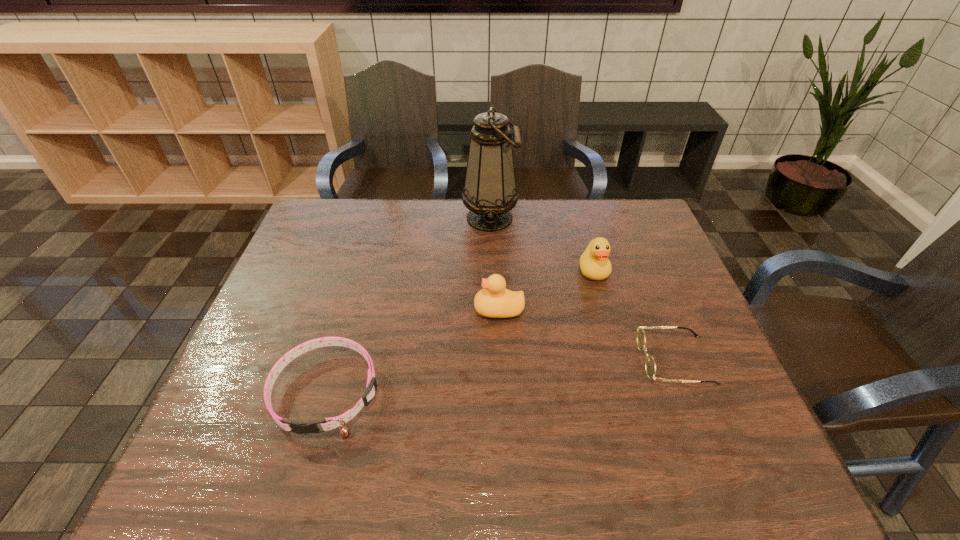
The width and height of the screenshot is (960, 540). Find the location of `free space between the nearer duck and the shortest object`. free space between the nearer duck and the shortest object is located at coordinates (587, 335).

Where is `empty space that is in between the left duck and the leftmost object`? empty space that is in between the left duck and the leftmost object is located at coordinates (413, 350).

You are a GUI agent. You are given a task and a screenshot of the screen. Output one action in this format:
    pyautogui.click(x=<x>, y=<y>)
    Task: Click on the blank region between the leftmost object and the shortest object
    
    Given the screenshot: What is the action you would take?
    pyautogui.click(x=501, y=376)

Where is `empty space between the second object from right to left and the dog collar`? Image resolution: width=960 pixels, height=540 pixels. empty space between the second object from right to left and the dog collar is located at coordinates (460, 331).

At what (x,y) coordinates should I click in order to perform the action: click on vacant point located between the rightmost object and the third nearest object. Please return your answer as a coordinate pair (x, y). This screenshot has height=540, width=960. Looking at the image, I should click on (587, 335).

At what (x,y) coordinates should I click in order to perform the action: click on free point between the oil lamp and the rightmost object. Please return your answer as a coordinate pair (x, y). The image size is (960, 540). Looking at the image, I should click on (582, 289).

This screenshot has width=960, height=540. What are the coordinates of `object that is the second closest to the second farthest object` in the screenshot? It's located at (650, 367).

Identify which object is located as the second nearest to the spectacles. Please provide its 2D coordinates. Your answer should be formatted as a tuple, i.e. [(x, y)], where the tuple contains the x and y coordinates of a point satisfying the conditions above.

[(494, 301)]

Find the location of a particular element. vacant area that satisfies the following two spatial constraints: 1. on the face of the left duck; 2. with the buckle on the leftmost object is located at coordinates (502, 392).

Image resolution: width=960 pixels, height=540 pixels. I want to click on free space that satisfies the following two spatial constraints: 1. on the face of the third farthest object; 2. with the buckle on the dog collar, so click(x=502, y=392).